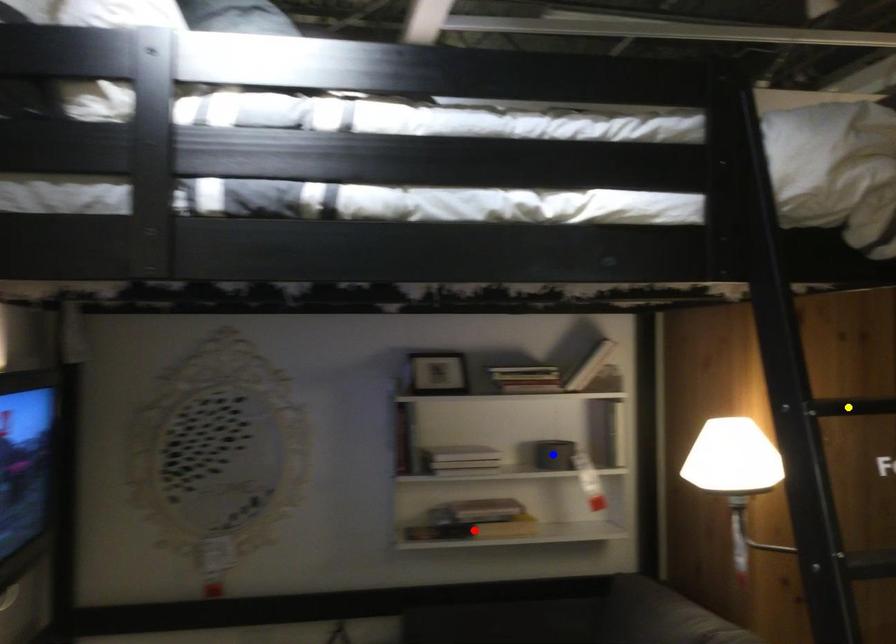
Order these from nearest to farthest:
A) red point
B) yellow point
C) blue point

1. yellow point
2. red point
3. blue point